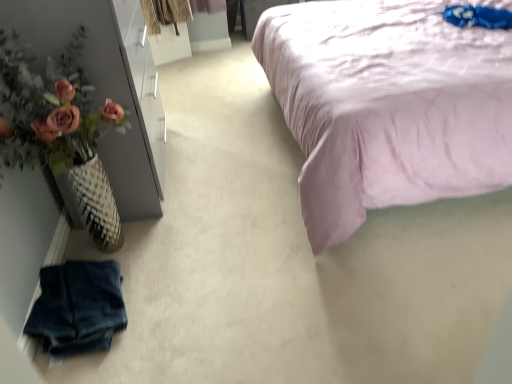
Image resolution: width=512 pixels, height=384 pixels. Identify the location of unoccupied space behind faded denim shorts at lower left. (137, 240).